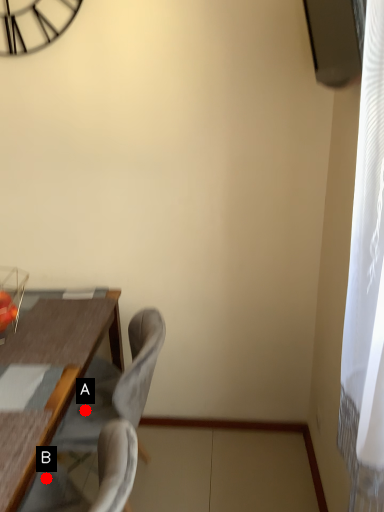
Question: Two points are circled on the image, labeled by A and B beside each circle. Which of the following is the farthest from the observer?

Choices:
 (A) A is further
 (B) B is further

Answer: (A)